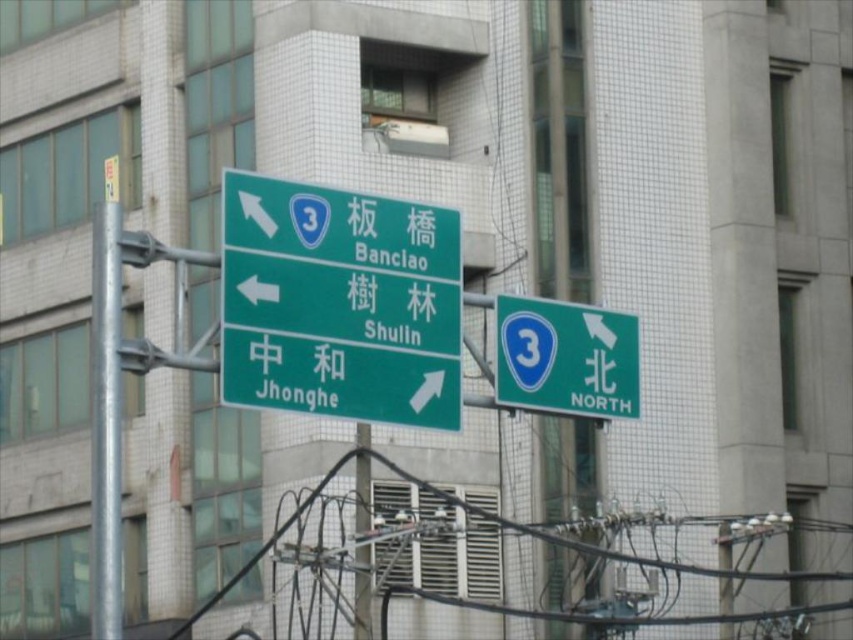
You are a pedestrian standing in front of the multi story building with modern architecture. You see the green glossy signboard at center and the green glossy road sign at upper right. Which one is positioned more to the left?

The green glossy signboard at center is positioned to the left of green glossy road sign at upper right, so the green glossy signboard at center is more to the left.